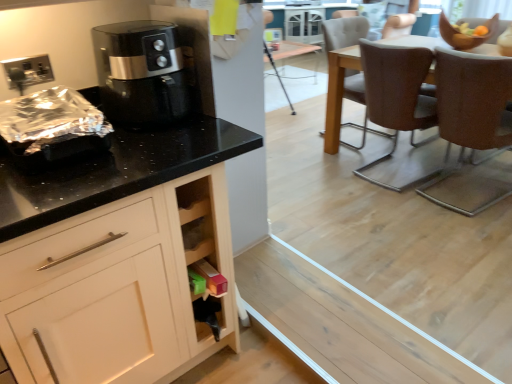
Find the location of a particular element. The image size is (512, 384). free location in front of brown leather chair at center, which is counted as the 2th chair, starting from the front is located at coordinates (406, 211).